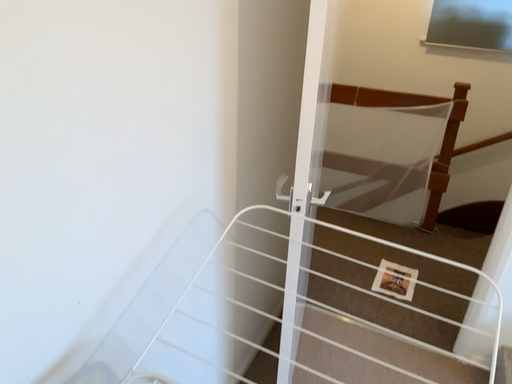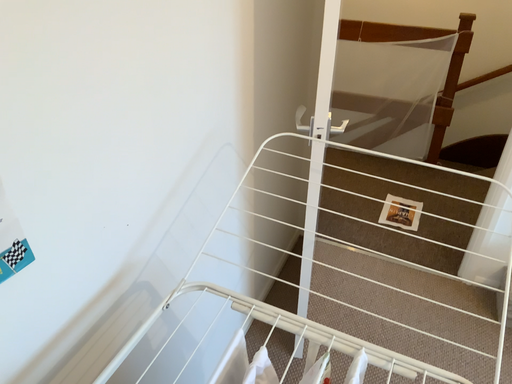
Question: How did the camera likely rotate when shooting the video?

Choices:
 (A) rotated downward
 (B) rotated upward

Answer: (A)